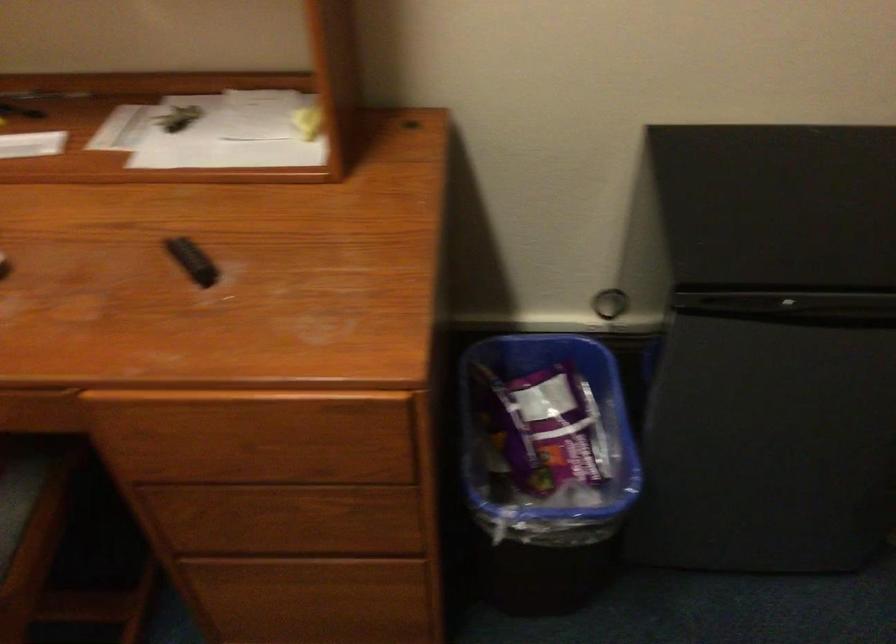
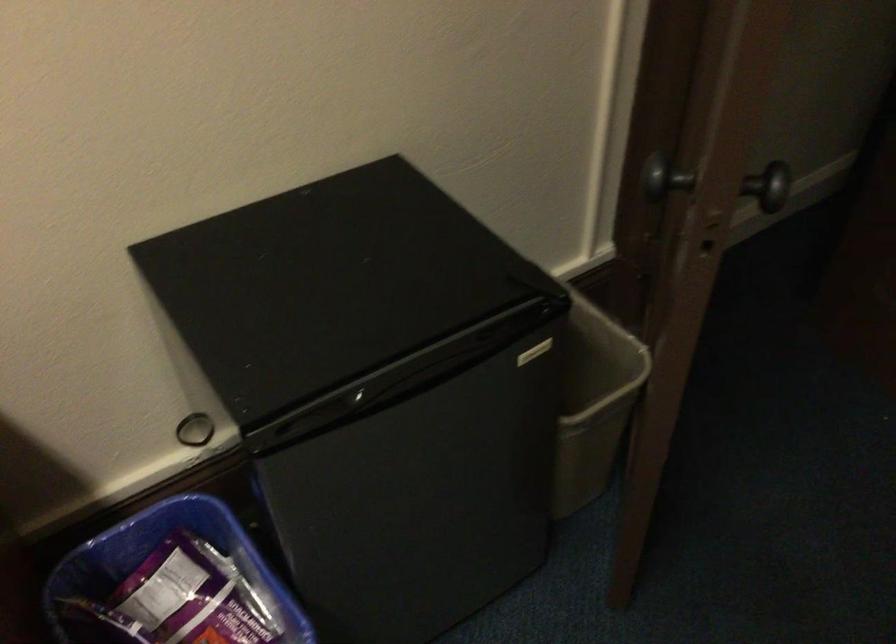
Where in the second image is the point corresponding to point (789, 306) from the first image?

(365, 399)